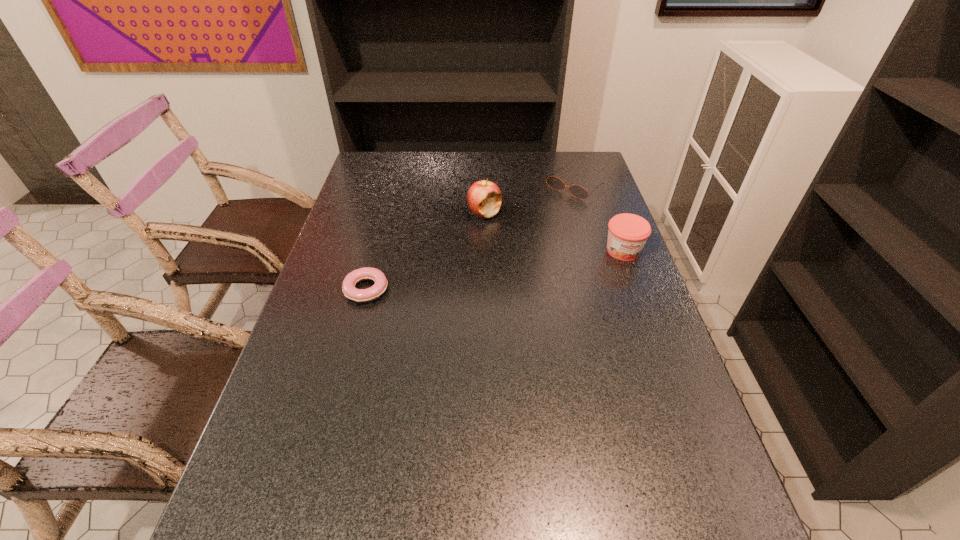
This screenshot has width=960, height=540. I want to click on the leftmost object, so tap(366, 273).

The height and width of the screenshot is (540, 960). I want to click on the nearest object, so click(366, 273).

Locate an element on the screen. The width and height of the screenshot is (960, 540). the second nearest object is located at coordinates (627, 233).

I want to click on the third shortest object, so click(x=627, y=233).

Where is `the third tallest object`? This screenshot has height=540, width=960. the third tallest object is located at coordinates (577, 191).

This screenshot has width=960, height=540. What are the coordinates of `sunglasses` in the screenshot? It's located at (577, 191).

The width and height of the screenshot is (960, 540). I want to click on apple, so click(x=484, y=197).

At what (x,y) coordinates should I click in order to perform the action: click on the tallest object. Please return your answer as a coordinate pair (x, y). The width and height of the screenshot is (960, 540). Looking at the image, I should click on (484, 197).

The height and width of the screenshot is (540, 960). In order to click on vacant space situated 0.360m on the front of the doughnut in this screenshot , I will do `click(327, 435)`.

The width and height of the screenshot is (960, 540). I want to click on blank space located on the front label of the second tallest object, so click(x=655, y=337).